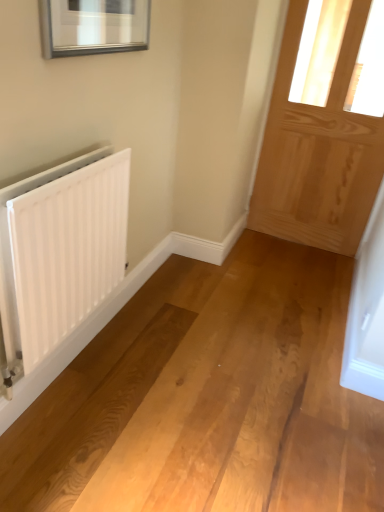
Identify the location of white matte radiator at left. (62, 251).

Image resolution: width=384 pixels, height=512 pixels. Describe the element at coordinates (62, 251) in the screenshot. I see `white matte radiator at left` at that location.

What do you see at coordinates (318, 152) in the screenshot?
I see `natural wood door at right` at bounding box center [318, 152].

This screenshot has height=512, width=384. Identify the location of natural wood door at right. (318, 152).

You are a GUI agent. You are given a task and a screenshot of the screen. Output one action in this format:
    pyautogui.click(x=<x>, y=<y>)
    Task: Click on the white matte radiator at left
    
    Given the screenshot: What is the action you would take?
    pyautogui.click(x=62, y=251)

Does white matte radiator at left appear on the left side of natural wood door at right?

Yes, white matte radiator at left is to the left of natural wood door at right.

Which object is further away from the camera, white matte radiator at left or natural wood door at right?

natural wood door at right is more distant.

Does point (32, 333) appear closer or farther from the camera than point (367, 160)?

Clearly, point (32, 333) is closer to the camera than point (367, 160).

Based on the photo, from the image's perspective, which is above, white matte radiator at left or natural wood door at right?

natural wood door at right, from the image's perspective.

From a real-world perspective, is white matte radiator at left located higher than natural wood door at right?

No.

Which object is thinner, white matte radiator at left or natural wood door at right?

white matte radiator at left is thinner.

Can you confirm if white matte radiator at left is shorter than natural wood door at right?

Indeed, white matte radiator at left has a lesser height compared to natural wood door at right.

From the picture: Which of these two, white matte radiator at left or natural wood door at right, is smaller?

With smaller size is white matte radiator at left.

Is white matte radiator at left inside or outside of natural wood door at right?

white matte radiator at left is spatially situated outside natural wood door at right.

Is white matte radiator at left positioned far away from natural wood door at right?

Yes, white matte radiator at left and natural wood door at right are located far from each other.

Is white matte radiator at left facing towards natural wood door at right?

No, white matte radiator at left does not turn towards natural wood door at right.

Locate an element on the screen. door positioned vertically above the white matte radiator at left (from a real-world perspective) is located at coordinates coord(318,152).

Between natural wood door at right and white matte radiator at left, which one appears on the right side from the viewer's perspective?

natural wood door at right is more to the right.

Considering the positions of objects natural wood door at right and white matte radiator at left in the image provided, who is behind, natural wood door at right or white matte radiator at left?

natural wood door at right is behind.

Considering the positions of points (301, 4) and (84, 312), is point (301, 4) farther from camera compared to point (84, 312)?

Yes, point (301, 4) is behind point (84, 312).

From the picture: From the image's perspective, relative to white matte radiator at left, is natural wood door at right above or below?

Based on their image positions, natural wood door at right is located above white matte radiator at left.

From a real-world perspective, which is physically below, natural wood door at right or white matte radiator at left?

white matte radiator at left is physically lower.

Does natural wood door at right have a greater width compared to white matte radiator at left?

Indeed, natural wood door at right has a greater width compared to white matte radiator at left.

Considering the relative sizes of natural wood door at right and white matte radiator at left in the image provided, is natural wood door at right shorter than white matte radiator at left?

Result: No.

Does natural wood door at right have a smaller size compared to white matte radiator at left?

No.

Is white matte radiator at left located within natural wood door at right?

No, white matte radiator at left is not a part of natural wood door at right.

Can you see natural wood door at right touching white matte radiator at left?

natural wood door at right is not next to white matte radiator at left, and they're not touching.

Could you tell me if natural wood door at right is facing white matte radiator at left?

Yes, natural wood door at right is oriented towards white matte radiator at left.

I want to click on radiator that appears below the natural wood door at right (from a real-world perspective), so click(62, 251).

I want to click on door positioned vertically above the white matte radiator at left (from a real-world perspective), so click(x=318, y=152).

Identify the location of radiator lying in front of the natural wood door at right. Image resolution: width=384 pixels, height=512 pixels. (62, 251).